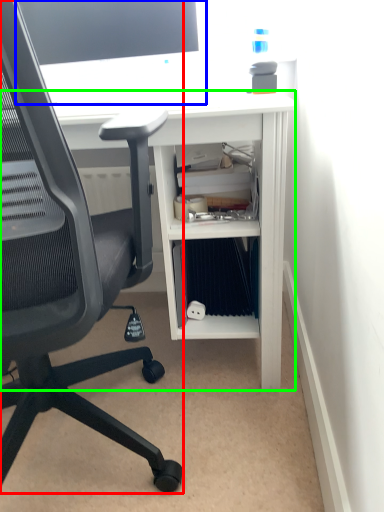
Question: Based on their relative distances, which object is farther from chair (highlighted by a red box)? Choose from desktop computer (highlighted by a blue box) and desk (highlighted by a green box).

Choices:
 (A) desktop computer
 (B) desk

Answer: (A)